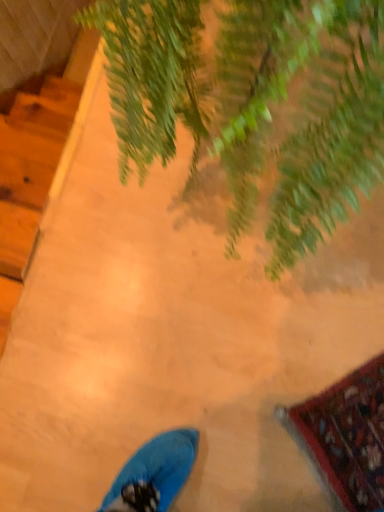
The width and height of the screenshot is (384, 512). I want to click on free spot in front of green leafy plant at upper center, so point(237,397).